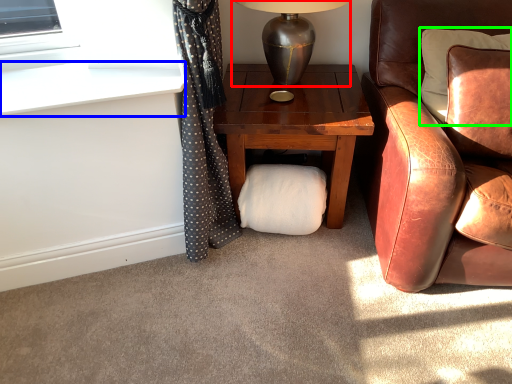
Question: Considering the real-world distances, which object is farthest from table lamp (highlighted by a red box)? window sill (highlighted by a blue box) or pillow (highlighted by a green box)?

Choices:
 (A) window sill
 (B) pillow

Answer: (A)